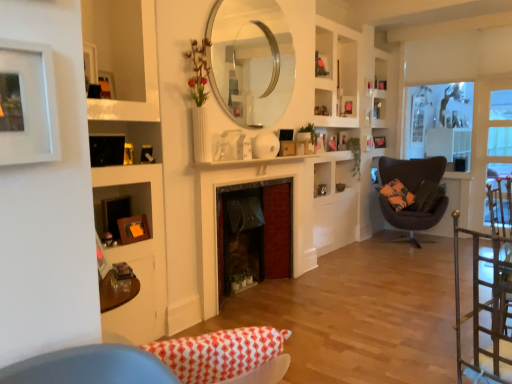
Question: From a real-world perspective, is wooden picture frame at upper center, positioned as the 8th picture frame in bottom-to-top order, physically above wooden picture frame at center, acting as the fourth picture frame starting from the bottom?

Choices:
 (A) yes
 (B) no

Answer: (A)

Question: Is wooden picture frame at upper center, the first picture frame when ordered from top to bottom, closer to the viewer compared to wooden picture frame at center, acting as the fourth picture frame starting from the bottom?

Choices:
 (A) yes
 (B) no

Answer: (A)

Question: Considering the relative sizes of wooden picture frame at upper center, positioned as the 5th picture frame in right-to-left order, and wooden picture frame at center, the 4th picture frame when ordered from back to front, in the image provided, is wooden picture frame at upper center, positioned as the 5th picture frame in right-to-left order, taller than wooden picture frame at center, the 4th picture frame when ordered from back to front,?

Choices:
 (A) no
 (B) yes

Answer: (B)

Question: Is wooden picture frame at upper center, the first picture frame when ordered from top to bottom, at the left side of wooden picture frame at center, the fifth picture frame viewed from the front?

Choices:
 (A) no
 (B) yes

Answer: (B)

Question: Considering the relative sizes of wooden picture frame at upper center, positioned as the 5th picture frame in right-to-left order, and wooden picture frame at center, the 4th picture frame when ordered from back to front, in the image provided, is wooden picture frame at upper center, positioned as the 5th picture frame in right-to-left order, thinner than wooden picture frame at center, the 4th picture frame when ordered from back to front,?

Choices:
 (A) no
 (B) yes

Answer: (A)

Question: Is point pyautogui.click(x=334, y=137) closer or farther from the camera than point pyautogui.click(x=497, y=129)?

Choices:
 (A) farther
 (B) closer

Answer: (A)

Question: Is wooden picture frame at center, placed as the 5th picture frame when sorted from top to bottom, taller or shorter than clear glass window screen at right?

Choices:
 (A) tall
 (B) short

Answer: (B)

Question: In the image, is wooden picture frame at center, acting as the fourth picture frame starting from the bottom, positioned in front of or behind clear glass window screen at right?

Choices:
 (A) front
 (B) behind

Answer: (A)

Question: In the image, is wooden picture frame at center, the 5th picture frame positioned from the left, on the left side or the right side of clear glass window screen at right?

Choices:
 (A) left
 (B) right

Answer: (A)

Question: In terms of size, does wooden picture frame at upper right, arranged as the first picture frame when viewed from the back, appear bigger or smaller than wooden picture frame at center, the 3th picture frame positioned from the front?

Choices:
 (A) big
 (B) small

Answer: (B)

Question: Would you say wooden picture frame at upper right, acting as the 8th picture frame starting from the left, is to the left or to the right of wooden picture frame at center, the 3th picture frame positioned from the front, in the picture?

Choices:
 (A) right
 (B) left

Answer: (A)

Question: Would you say wooden picture frame at upper right, the 1th picture frame from the right, is inside or outside wooden picture frame at center, the sixth picture frame positioned from the top?

Choices:
 (A) inside
 (B) outside

Answer: (B)

Question: Is wooden picture frame at upper right, the eighth picture frame viewed from the front, taller or shorter than wooden picture frame at center, the 6th picture frame viewed from the right?

Choices:
 (A) tall
 (B) short

Answer: (A)

Question: Considering the positions of clear glass window screen at right and wooden picture frame at center, placed as the 5th picture frame when sorted from top to bottom, in the image, is clear glass window screen at right bigger or smaller than wooden picture frame at center, placed as the 5th picture frame when sorted from top to bottom,?

Choices:
 (A) big
 (B) small

Answer: (A)

Question: From their relative heights in the image, would you say clear glass window screen at right is taller or shorter than wooden picture frame at center, the 4th picture frame when ordered from back to front?

Choices:
 (A) tall
 (B) short

Answer: (A)